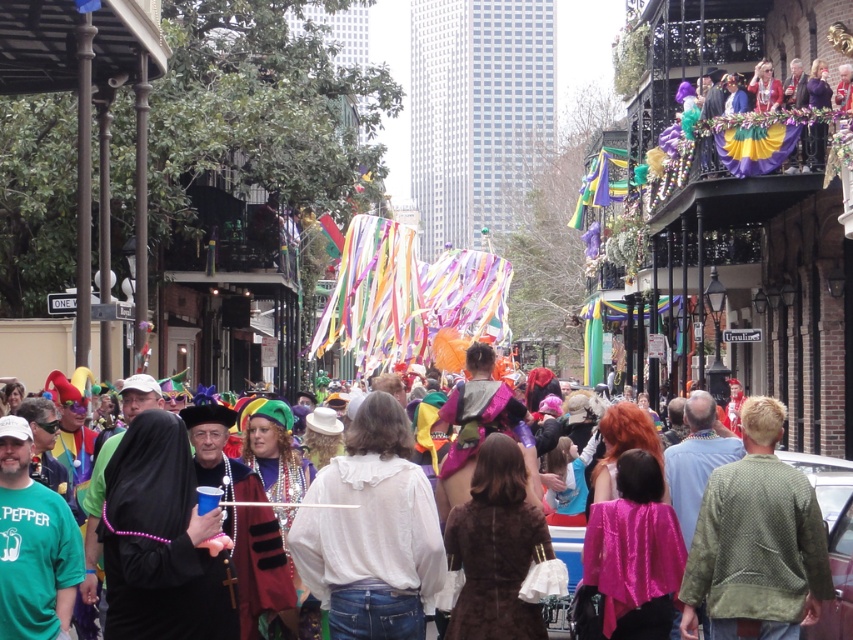
You are a photographer standing at the street level during the Mardi Gras parade. You want to take a photo of the white cotton shirt at center. Considering the distance, can you capture a clear closeup shot without moving closer?

The white cotton shirt at center is 55.81 meters away from the viewer. A standard camera lens would struggle to capture a clear closeup at this distance, so you would need a telephoto lens to achieve the desired result.